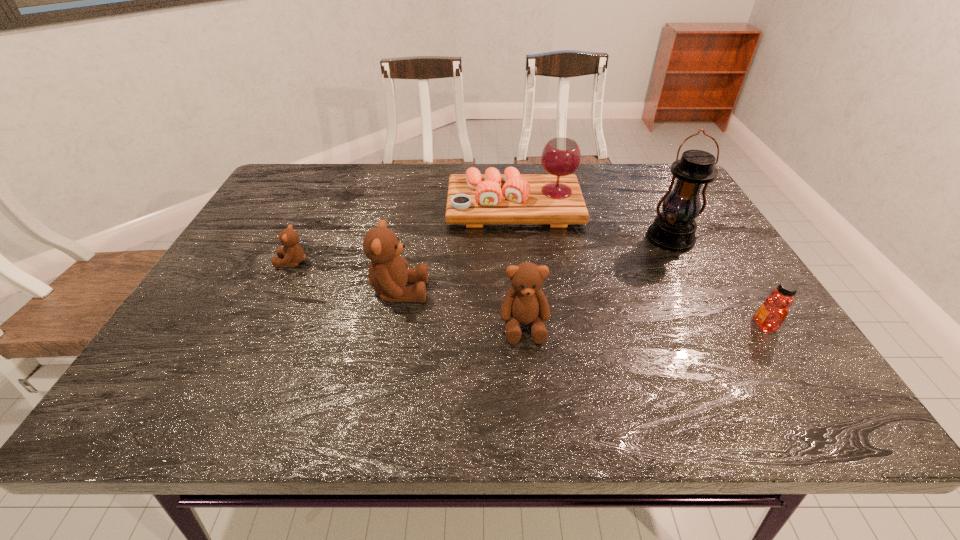
Where is `free space located 0.140m on the face of the leftmost object`? The height and width of the screenshot is (540, 960). free space located 0.140m on the face of the leftmost object is located at coordinates (221, 262).

In order to click on free space located on the face of the fifth object from right to left in this screenshot , I will do `click(489, 292)`.

Can you point to a free location located 0.190m above the lantern, indicating its light source? Please provide its 2D coordinates. Your answer should be formatted as a tuple, i.e. [(x, y)], where the tuple contains the x and y coordinates of a point satisfying the conditions above.

[(708, 309)]

Locate an element on the screen. free spot located on the right of the platter is located at coordinates (639, 207).

Identify the location of vacant region located 0.220m on the front label of the honey. (649, 325).

Locate an element on the screen. This screenshot has width=960, height=540. vacant space located 0.230m on the front label of the honey is located at coordinates (644, 325).

Image resolution: width=960 pixels, height=540 pixels. I want to click on vacant space situated 0.220m on the front label of the honey, so click(649, 325).

Image resolution: width=960 pixels, height=540 pixels. Find the location of `object located in the far edge section of the desktop`. object located in the far edge section of the desktop is located at coordinates (474, 199).

I want to click on object that is at the near edge, so click(525, 303).

The height and width of the screenshot is (540, 960). I want to click on object that is positioned at the left edge, so click(x=292, y=254).